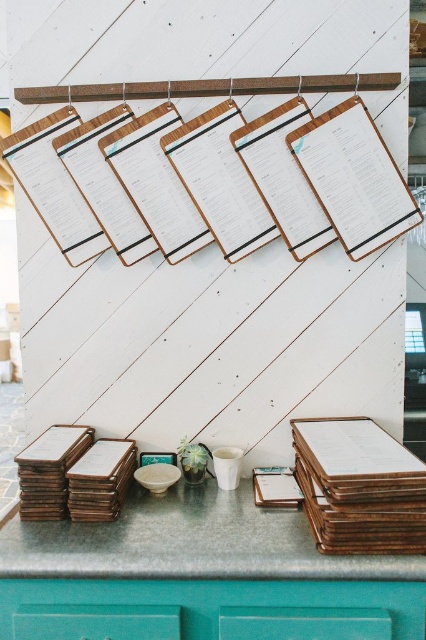
You are a customer at the restaurant and want to grab a menu from the wooden clipboard at lower right. However, there is a teal glass vase at center in the way. Can you reach the clipboard without moving the vase?

The wooden clipboard at lower right has a greater height compared to the teal glass vase at center. Since the clipboard is taller, you can reach it by going around the vase or reaching over it, so yes, you can grab the menu without moving the vase.

You are a customer standing at the camera position. You want to grab a menu from the metallic green counter at bottom. Can you reach it without moving your feet?

The metallic green counter at bottom and camera are 1.20 meters apart from each other. Since the distance is within a typical arm reach, you can likely grab the menu without moving your feet.

You are a customer standing in front of the metallic green counter at bottom and the teal glass vase at center. Which object is nearer to you?

The metallic green counter at bottom is closer to the viewer than the teal glass vase at center, so the metallic green counter at bottom is nearer to you.